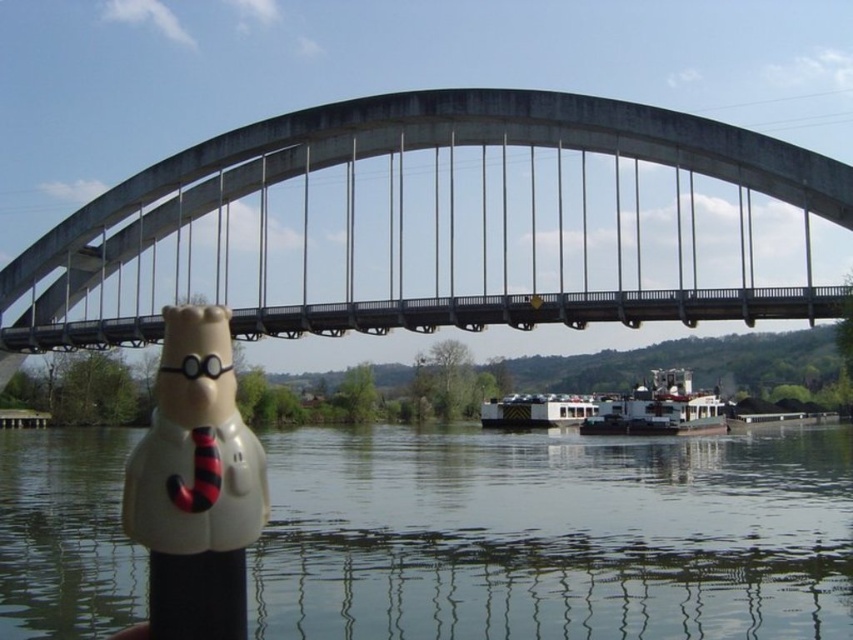
You are an architect evaluating the structural integrity of the concrete bridge at center and the transparent plastic water at lower center. Which object would you prioritize inspecting for potential safety concerns, and why?

The concrete bridge at center has a larger size compared to transparent plastic water at lower center, so the architect should prioritize inspecting the concrete bridge at center due to its larger size and structural importance for vehicular traffic.